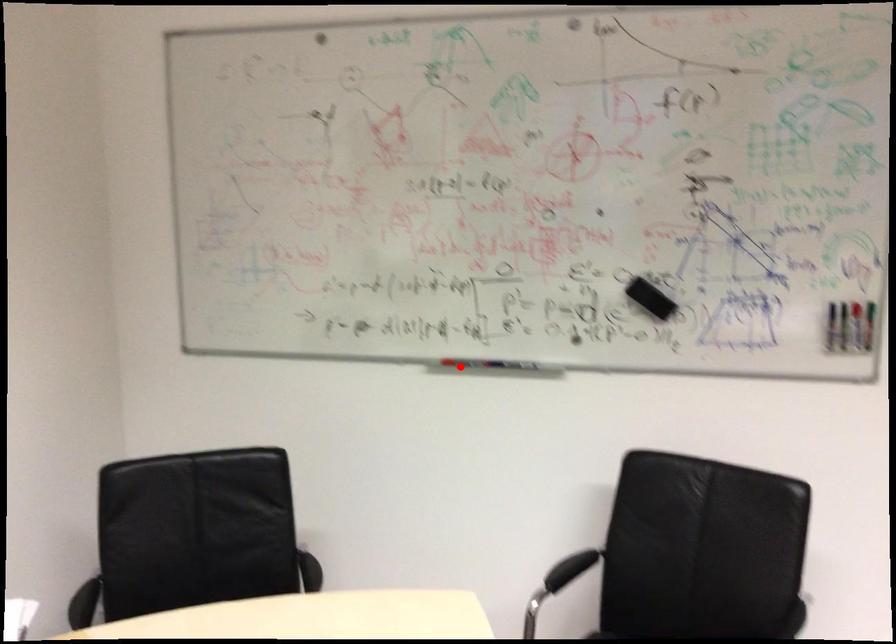
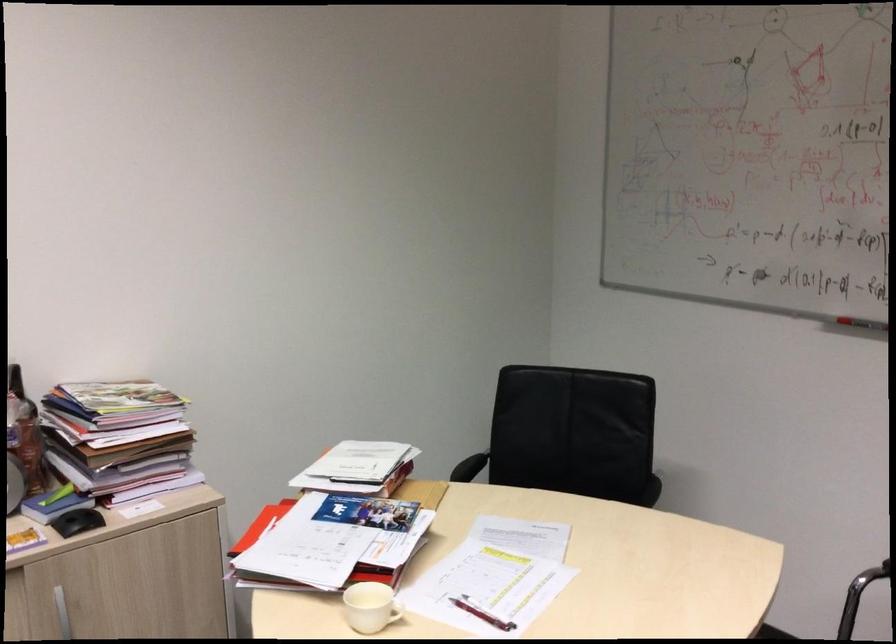
The point at the highlighted location is marked in the first image. Where is the corresponding point in the second image?

(860, 327)